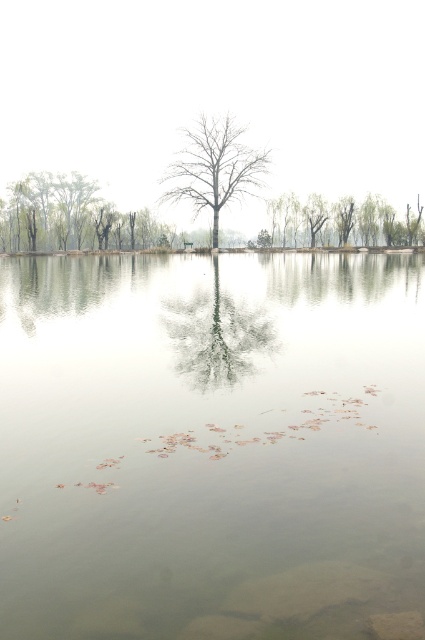
Does bare wood tree at center have a greater width compared to green leafy tree at center?

Incorrect, bare wood tree at center's width does not surpass green leafy tree at center's.

Between bare wood tree at center and green leafy tree at center, which one has more height?

bare wood tree at center is taller.

Which is behind, point (167, 186) or point (346, 212)?

The point (346, 212) is more distant.

Locate an element on the screen. Image resolution: width=425 pixels, height=640 pixels. bare wood tree at center is located at coordinates (215, 168).

Is green matte tree at left to the right of bare wood tree at center from the viewer's perspective?

In fact, green matte tree at left is to the left of bare wood tree at center.

Can you confirm if green matte tree at left is wider than bare wood tree at center?

Indeed, green matte tree at left has a greater width compared to bare wood tree at center.

Between point (19, 241) and point (238, 182), which one is positioned in front?

Point (238, 182)

Image resolution: width=425 pixels, height=640 pixels. I want to click on green matte tree at left, so click(x=71, y=218).

Is clear water at center taller than green matte tree at left?

Incorrect, clear water at center's height is not larger of green matte tree at left's.

Is clear water at center below green matte tree at left?

Yes.

Is point (121, 499) behind point (59, 204)?

No, (121, 499) is in front of (59, 204).

Locate an element on the screen. clear water at center is located at coordinates (x=210, y=445).